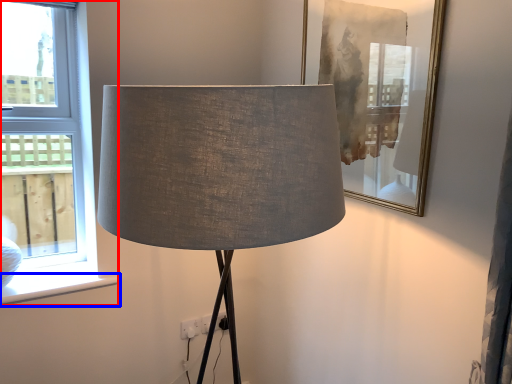
Question: Which point is closer to the camera, window (highlighted by a red box) or window sill (highlighted by a blue box)?

Choices:
 (A) window
 (B) window sill

Answer: (A)